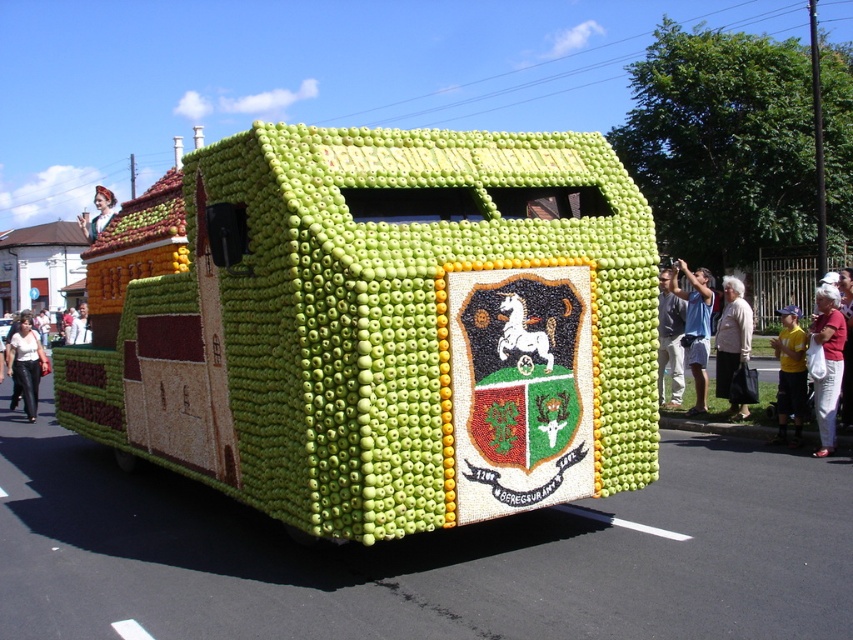
Question: Which is farther from the matte green apple at center?

Choices:
 (A) white cotton bag at lower right
 (B) white fabric shirt at left
 (C) light beige sweater at lower right

Answer: (B)

Question: Which point is farther from the camera taking this photo?

Choices:
 (A) (78, 305)
 (B) (99, 221)
 (C) (32, 326)
 (D) (787, 417)

Answer: (A)

Question: Can you confirm if light blue t-shirt at center is positioned to the right of matte white dress at upper left?

Choices:
 (A) no
 (B) yes

Answer: (B)

Question: Is white cotton bag at lower right wider than white fabric shirt at left?

Choices:
 (A) no
 (B) yes

Answer: (A)

Question: Which point is closer to the camera taking this photo?

Choices:
 (A) (91, 225)
 (B) (85, 326)
 (C) (685, 326)

Answer: (A)

Question: Does white cotton bag at lower right have a larger size compared to white leather pants at lower left?

Choices:
 (A) yes
 (B) no

Answer: (B)